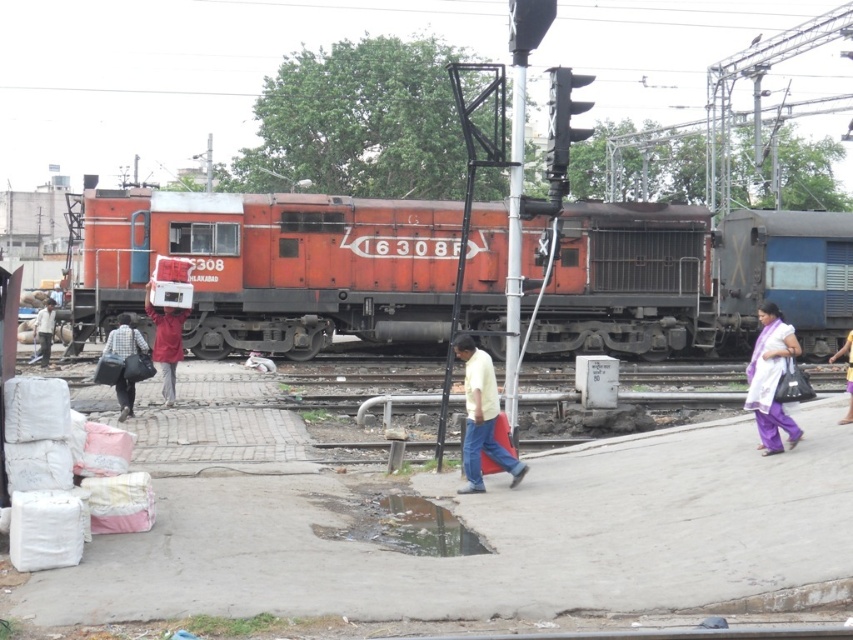
Question: Which point is farther to the camera?

Choices:
 (A) [850, 385]
 (B) [456, 336]
 (C) [775, 317]
 (D) [38, 356]

Answer: (D)

Question: From the image, what is the correct spatial relationship of white cotton saree at right in relation to light brown fabric bag at left?

Choices:
 (A) below
 (B) above

Answer: (A)

Question: Is yellow matte shirt at center below matte red jacket at center?

Choices:
 (A) yes
 (B) no

Answer: (A)

Question: Does light brown fabric bag at left appear under light pink fabric at center?

Choices:
 (A) yes
 (B) no

Answer: (B)

Question: Among these objects, which one is nearest to the camera?

Choices:
 (A) matte red jacket at center
 (B) light brown fabric bag at left
 (C) purple fabric at lower right
 (D) white cotton saree at right

Answer: (D)

Question: Which object appears closest to the camera in this image?

Choices:
 (A) matte orange train at center
 (B) light brown fabric bag at left
 (C) purple fabric at lower right
 (D) plaid fabric shirt at center

Answer: (C)